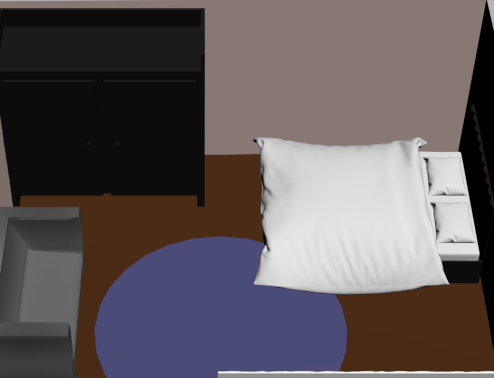
You are a GUI agent. You are given a task and a screenshot of the screen. Output one action in this format:
    pyautogui.click(x=<x>, y=<y>)
    Task: Click on the brown floor
    
    Given the screenshot: What is the action you would take?
    pyautogui.click(x=133, y=214)